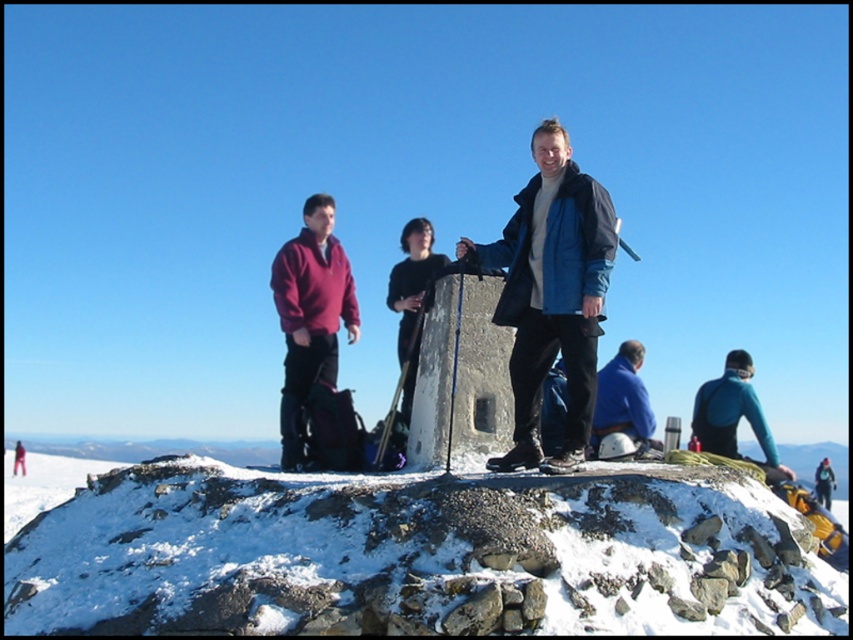
Question: Is white powdery snow at center behind blue fabric jacket at center?

Choices:
 (A) yes
 (B) no

Answer: (B)

Question: Which of the following is the farthest from the observer?

Choices:
 (A) white powdery snow at center
 (B) blue fabric jacket at center
 (C) maroon fleece at left

Answer: (C)

Question: Which of the following is the farthest from the observer?

Choices:
 (A) (381, 612)
 (B) (529, 349)
 (C) (277, 284)

Answer: (C)

Question: Which of these objects is positioned farthest from the white powdery snow at center?

Choices:
 (A) blue fabric jacket at center
 (B) maroon fleece at left

Answer: (A)

Question: Is white powdery snow at center bigger than maroon fleece at left?

Choices:
 (A) yes
 (B) no

Answer: (B)

Question: Is matte blue jacket at center above blue fabric jacket at center?

Choices:
 (A) yes
 (B) no

Answer: (B)